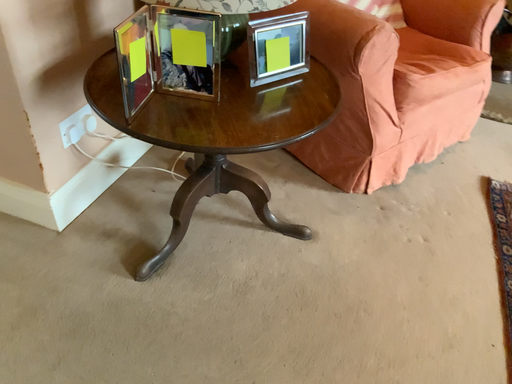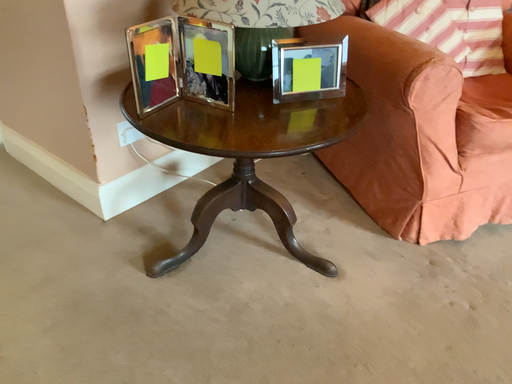
Question: Which way did the camera rotate in the video?

Choices:
 (A) rotated upward
 (B) rotated downward

Answer: (A)